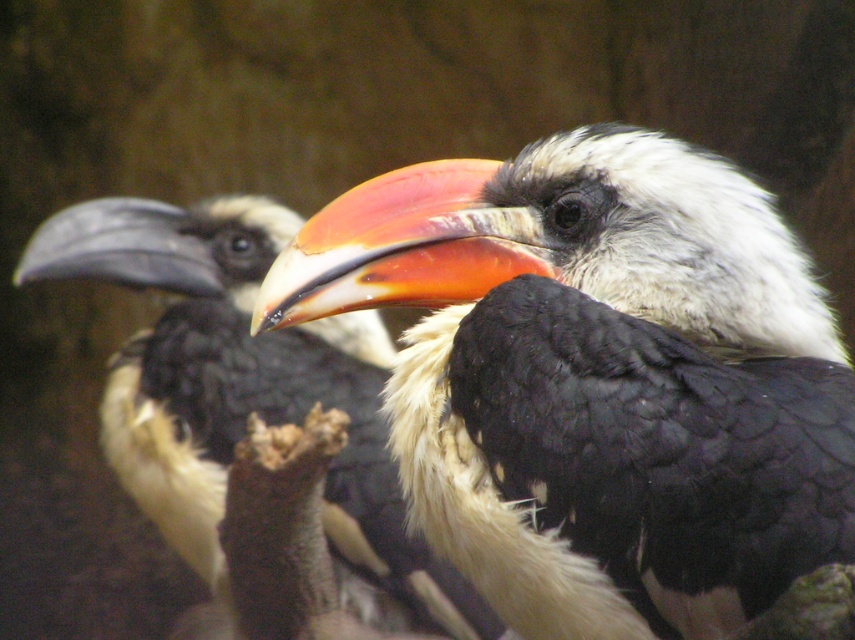
You are a zookeeper who needs to feed two birds. The first bird has a white matte beak at center. The second bird is partially hidden behind the first. How far apart are the two birds?

The two birds are 5.07 feet apart.

You are a zookeeper observing two birds in their enclosure. You notice a white matte beak at center and a white feathered bird at left. Which object is positioned to the right of the other?

The white matte beak at center is positioned to the right of the white feathered bird at left.